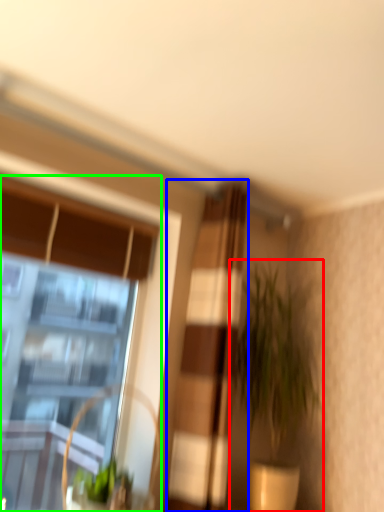
Question: Considering the real-world distances, which object is closest to houseplant (highlighted by a red box)? curtain (highlighted by a blue box) or window (highlighted by a green box).

Choices:
 (A) curtain
 (B) window

Answer: (A)